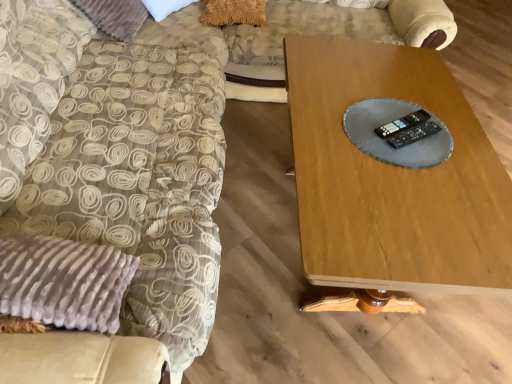
Find the location of a particular element. This screenshot has height=384, width=512. vacant area situated to the left side of black plastic remote at center, which is the first control from bottom to top is located at coordinates (359, 132).